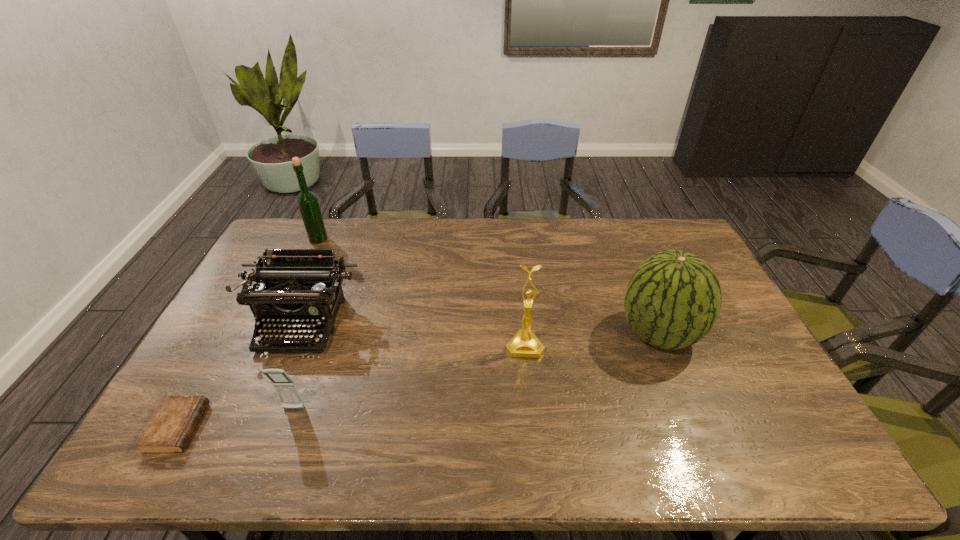
At what (x,y) coordinates should I click in order to perform the action: click on liquor. Please return your answer as a coordinate pair (x, y). Image resolution: width=960 pixels, height=540 pixels. Looking at the image, I should click on (307, 201).

The width and height of the screenshot is (960, 540). In order to click on award in this screenshot , I will do `click(525, 343)`.

In order to click on the rightmost object in this screenshot , I will do `click(673, 299)`.

Find the location of a particular element. typewriter is located at coordinates (300, 287).

Locate an element on the screen. the fifth tallest object is located at coordinates (286, 388).

Identify the location of the shortest object. The image size is (960, 540). (171, 426).

Identify the location of free space located 0.310m on the right of the liquor. This screenshot has height=540, width=960. (410, 239).

Find the location of a particular element. This screenshot has height=540, width=960. vacant region located 0.210m on the front-facing side of the award is located at coordinates (533, 428).

Where is `free space located on the back of the watermelon`? This screenshot has width=960, height=540. free space located on the back of the watermelon is located at coordinates (631, 267).

What are the coordinates of `vacant position located on the keyboard of the fourth tallest object` in the screenshot? It's located at (273, 392).